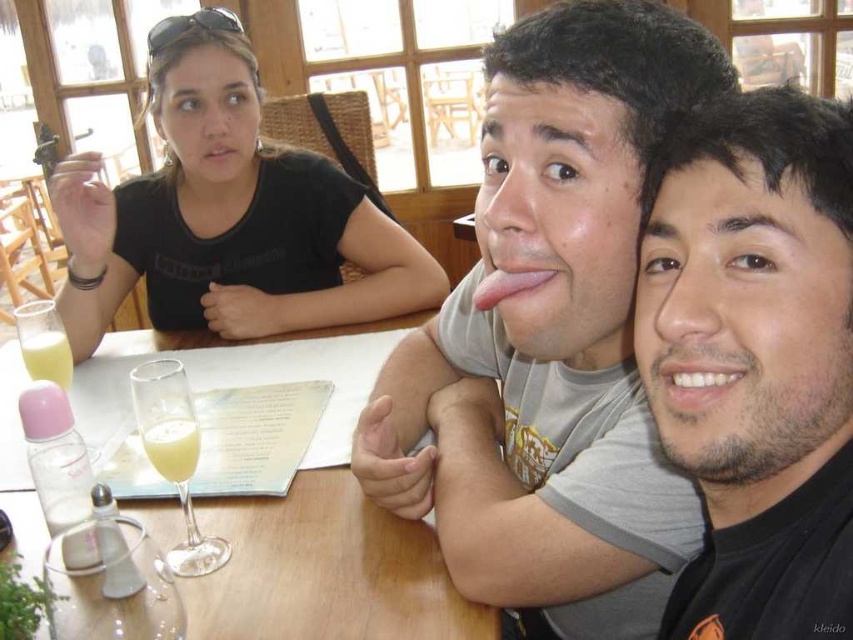
Question: Considering the relative positions of black matte face at center and yellow liquid at table center in the image provided, where is black matte face at center located with respect to yellow liquid at table center?

Choices:
 (A) right
 (B) left

Answer: (A)

Question: Which object appears farthest from the camera in this image?

Choices:
 (A) black matte face at center
 (B) translucent plastic cup at table left
 (C) wooden table at center

Answer: (B)

Question: Which point appears farthest from the camera in this image?

Choices:
 (A) (489, 280)
 (B) (329, 480)

Answer: (B)

Question: Which object appears closest to the camera in this image?

Choices:
 (A) white glossy teeth at center
 (B) pink matte lips at upper center

Answer: (A)

Question: Observing the image, what is the correct spatial positioning of black matte shirt at upper left in reference to pink matte lips at upper center?

Choices:
 (A) below
 (B) above

Answer: (A)

Question: Is gray matte t-shirt at center to the right of black matte face at center from the viewer's perspective?

Choices:
 (A) yes
 (B) no

Answer: (B)